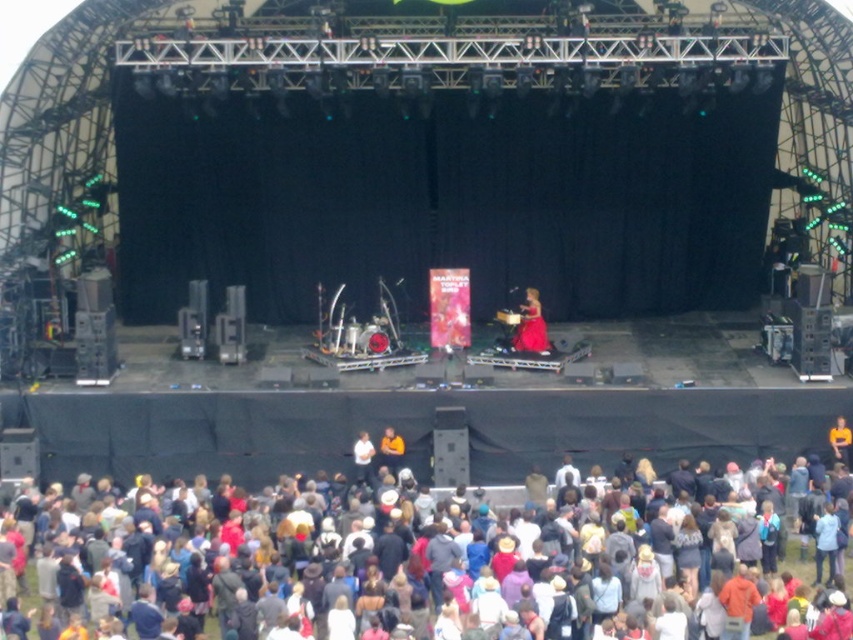
Between point (695, 561) and point (521, 316), which one is positioned behind?

Point (521, 316)

Between point (846, 612) and point (525, 328), which one is positioned behind?

Point (525, 328)

Locate an element on the screen. This screenshot has width=853, height=640. multicolored fabric crowd at lower center is located at coordinates (306, 572).